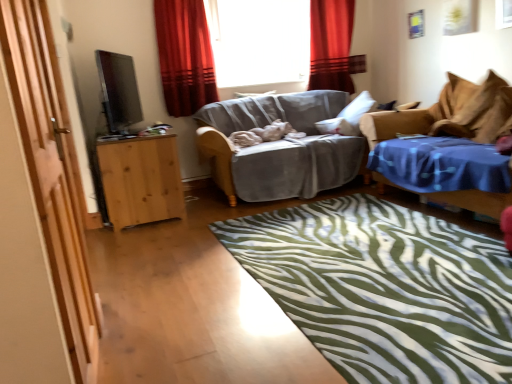
Question: Is red velvet curtain at upper center, which ranks as the second curtain in back-to-front order, bigger or smaller than blue fabric studio couch at right, the 1th studio couch from the right?

Choices:
 (A) big
 (B) small

Answer: (B)

Question: From their relative heights in the image, would you say red velvet curtain at upper center, placed as the 1th curtain when sorted from front to back, is taller or shorter than blue fabric studio couch at right, the 1th studio couch from the right?

Choices:
 (A) short
 (B) tall

Answer: (B)

Question: Which is farther from the blue fabric studio couch at right, which ranks as the second studio couch in left-to-right order?

Choices:
 (A) gray fabric couch at center, positioned as the 1th studio couch in left-to-right order
 (B) green zebra-patterned rug at center
 (C) transparent glass window at center
 (D) light brown wooden cabinet at left
 (E) wooden door at left

Answer: (E)

Question: Which of these objects is positioned closest to the red velvet curtain at upper center, placed as the 1th curtain when sorted from front to back?

Choices:
 (A) blue fabric studio couch at right, which ranks as the second studio couch in left-to-right order
 (B) green zebra-patterned rug at center
 (C) satin black tv at left
 (D) gray fabric couch at center, positioned as the 1th studio couch in left-to-right order
 (E) light brown wooden cabinet at left

Answer: (C)